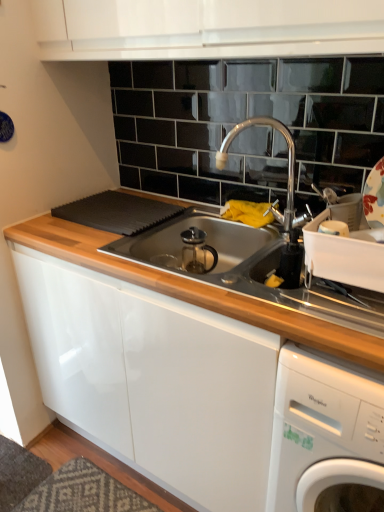
Question: Is white glossy washing machine at lower right taller than polished chrome faucet at upper center?

Choices:
 (A) no
 (B) yes

Answer: (B)

Question: Considering the relative positions of white glossy washing machine at lower right and polished chrome faucet at upper center in the image provided, is white glossy washing machine at lower right in front of polished chrome faucet at upper center?

Choices:
 (A) yes
 (B) no

Answer: (A)

Question: Is polished chrome faucet at upper center at the back of white glossy washing machine at lower right?

Choices:
 (A) no
 (B) yes

Answer: (A)

Question: Considering the relative sizes of white glossy washing machine at lower right and polished chrome faucet at upper center in the image provided, is white glossy washing machine at lower right shorter than polished chrome faucet at upper center?

Choices:
 (A) no
 (B) yes

Answer: (A)

Question: Can you confirm if white glossy washing machine at lower right is bigger than polished chrome faucet at upper center?

Choices:
 (A) yes
 (B) no

Answer: (A)

Question: Considering the relative positions of white glossy washing machine at lower right and polished chrome faucet at upper center in the image provided, is white glossy washing machine at lower right to the left of polished chrome faucet at upper center from the viewer's perspective?

Choices:
 (A) yes
 (B) no

Answer: (B)

Question: From a real-world perspective, is polished chrome faucet at upper center under white glossy washing machine at lower right?

Choices:
 (A) no
 (B) yes

Answer: (A)

Question: Can you confirm if polished chrome faucet at upper center is smaller than white glossy washing machine at lower right?

Choices:
 (A) no
 (B) yes

Answer: (B)

Question: Is polished chrome faucet at upper center aimed at white glossy washing machine at lower right?

Choices:
 (A) no
 (B) yes

Answer: (A)

Question: Is polished chrome faucet at upper center further to the viewer compared to white glossy washing machine at lower right?

Choices:
 (A) no
 (B) yes

Answer: (B)

Question: From the image's perspective, does polished chrome faucet at upper center appear higher than white glossy washing machine at lower right?

Choices:
 (A) no
 (B) yes

Answer: (B)

Question: Is polished chrome faucet at upper center in front of white glossy washing machine at lower right?

Choices:
 (A) no
 (B) yes

Answer: (A)

Question: From the image's perspective, relative to white glossy washing machine at lower right, is polished chrome faucet at upper center above or below?

Choices:
 (A) above
 (B) below

Answer: (A)